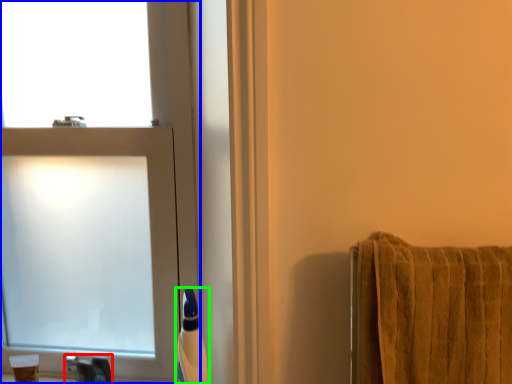
Question: Which is nearer to the faucet (highlighted by a red box)? window (highlighted by a blue box) or toiletry (highlighted by a green box).

Choices:
 (A) window
 (B) toiletry

Answer: (B)